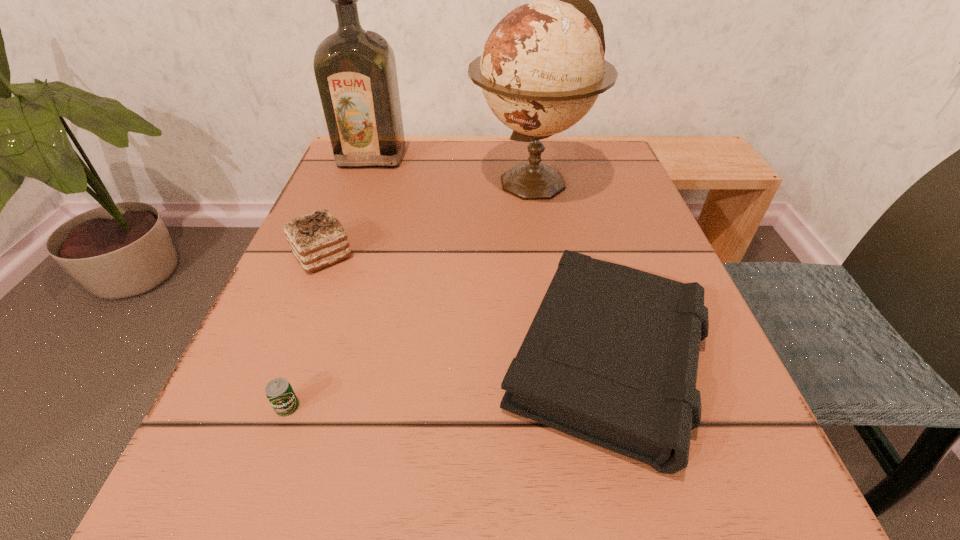
Where is `object located at the far left corner`? This screenshot has width=960, height=540. object located at the far left corner is located at coordinates (355, 70).

Where is `object present at the far right corner`? object present at the far right corner is located at coordinates (542, 68).

This screenshot has height=540, width=960. What are the coordinates of `object present at the near right corner` in the screenshot? It's located at (611, 357).

You are a GUI agent. You are given a task and a screenshot of the screen. Output one action in this format:
    pyautogui.click(x=<x>, y=<y>)
    Task: Click on the vacant space at the far edge
    The image size is (960, 540).
    Given the screenshot: What is the action you would take?
    pyautogui.click(x=509, y=192)

Where is `vacant space at the near edge of the desktop`? The height and width of the screenshot is (540, 960). vacant space at the near edge of the desktop is located at coordinates (448, 537).

Where is `vacant space at the left edge of the desktop`? The image size is (960, 540). vacant space at the left edge of the desktop is located at coordinates (317, 323).

Where is `vacant space at the right edge of the desktop`? Image resolution: width=960 pixels, height=540 pixels. vacant space at the right edge of the desktop is located at coordinates (723, 415).

This screenshot has height=540, width=960. I want to click on vacant region at the far right corner, so click(x=588, y=147).

The height and width of the screenshot is (540, 960). What are the coordinates of `free space between the globe and the liquor` in the screenshot? It's located at (452, 169).

The height and width of the screenshot is (540, 960). In order to click on vacant area that lies between the globe and the chocolate cake in this screenshot , I will do `click(427, 218)`.